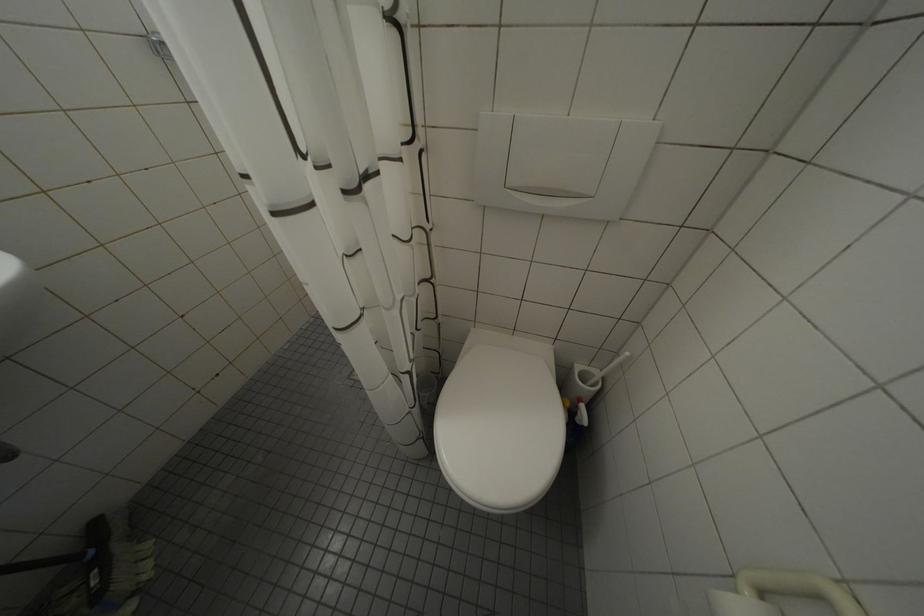
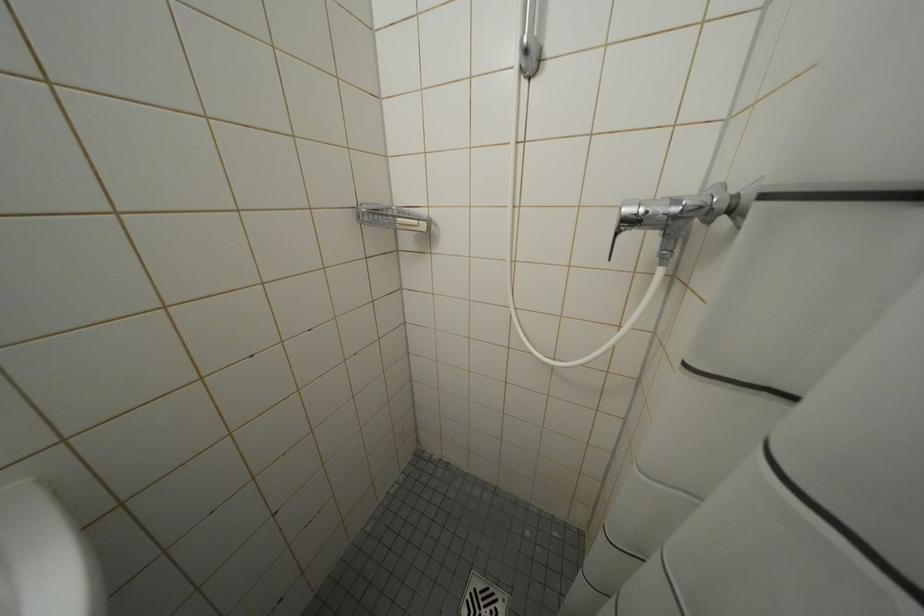
The images are taken continuously from a first-person perspective. In which direction are you moving?

The cameraman walked toward left, forward.